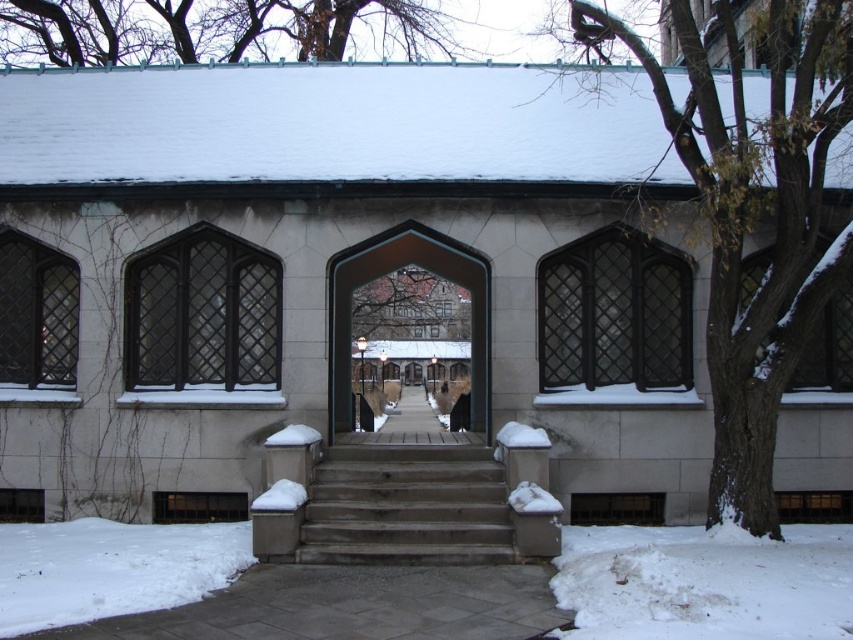
You are a delivery person carrying a heavy package and need to reach the entrance through the wooden stairs at center. There is also white powdery snow at lower left nearby. Which path has a narrower passage for you to navigate?

The wooden stairs at center has a lesser width compared to white powdery snow at lower left, so the wooden stairs at center has a narrower passage for you to navigate.

You are standing at the entrance of the stone structure and want to walk to the white powdery snow at lower left. Which direction should you move relative to the wooden stairs at center?

The white powdery snow at lower left is behind the wooden stairs at center, so you should move behind the wooden stairs at center to reach it.